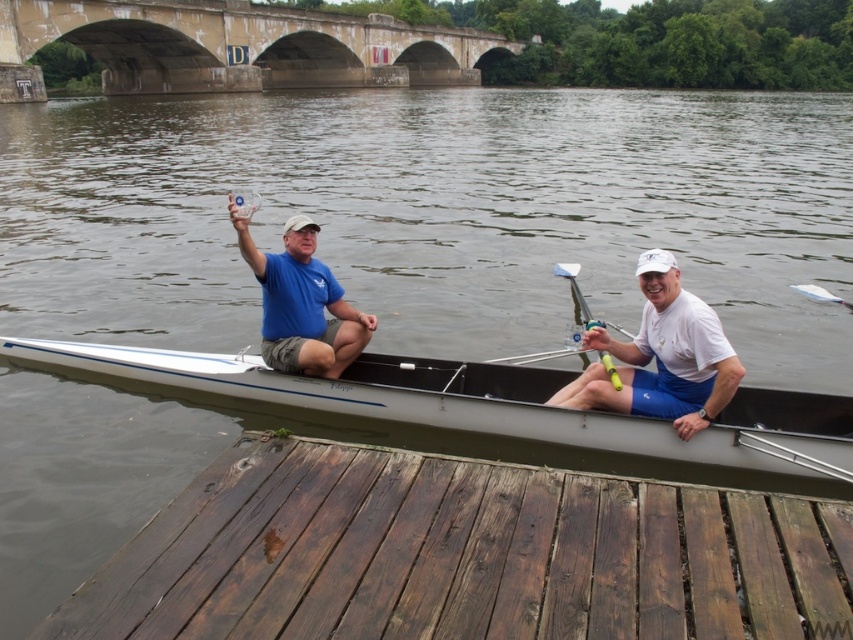
You are a photographer trying to capture the white matte rowing oar at center in the image. The camera you are using has a rectangular viewfinder with a 16x9 aspect ratio. If the point at coordinates [662,356] is the center of the viewfinder, will the entire white matte rowing oar at center fit within the viewfinder?

The point at coordinates [662,356] corresponds to the white matte rowing oar at center. Since the viewfinder has a 16x9 aspect ratio and the oar is centered at that point, it is likely that the entire white matte rowing oar at center will fit within the viewfinder as long as the oar does not extend beyond the edges defined by the aspect ratio.

You are standing on the bank of the river and see the white glossy boat at center and the concrete stone bridge at upper center. Which object is nearer to you?

The white glossy boat at center is closer to you than the concrete stone bridge at upper center.

You are a photographer standing on the riverbank and want to capture the white glossy boat at center in your shot. The boat is represented by the point at coordinates point (490, 406). What is the exact coordinate point of the boat?

The white glossy boat at center is represented by the point at coordinates point (490, 406).